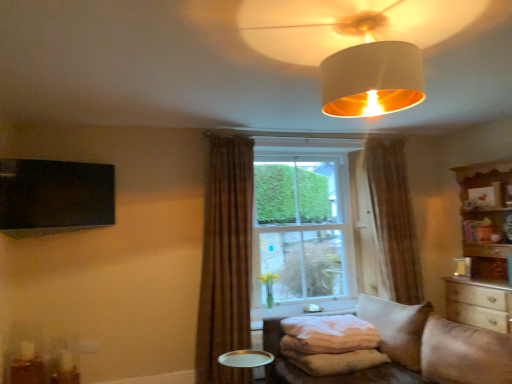
Locate an element on the screen. This screenshot has height=384, width=512. white fabric lampshade at upper center is located at coordinates (357, 44).

What do you see at coordinates (357, 44) in the screenshot?
I see `white fabric lampshade at upper center` at bounding box center [357, 44].

Locate an element on the screen. Image resolution: width=512 pixels, height=384 pixels. beige fabric studio couch at lower right is located at coordinates (420, 349).

Find the location of a particular element. Image resolution: width=512 pixels, height=384 pixels. white soft pillow at lower center is located at coordinates [x=328, y=334].

Image resolution: width=512 pixels, height=384 pixels. What do you see at coordinates (226, 260) in the screenshot?
I see `brown textured curtain at center, which is counted as the 2th curtain, starting from the back` at bounding box center [226, 260].

The image size is (512, 384). I want to click on white fabric lampshade at upper center, so click(357, 44).

From a real-world perspective, is brown sheer curtain at center, which is counted as the second curtain, starting from the front, physically located above or below metallic silver tray at lower center?

From a real-world perspective, brown sheer curtain at center, which is counted as the second curtain, starting from the front, is physically above metallic silver tray at lower center.

Identify the location of round table that appears in front of the brown sheer curtain at center, the first curtain in the right-to-left sequence. (246, 359).

Is brown sheer curtain at center, the first curtain in the right-to-left sequence, not inside metallic silver tray at lower center?

Absolutely, brown sheer curtain at center, the first curtain in the right-to-left sequence, is external to metallic silver tray at lower center.

Does beige fabric studio couch at lower right have a lesser height compared to clear glass window at center?

Indeed, beige fabric studio couch at lower right has a lesser height compared to clear glass window at center.

How many degrees apart are the facing directions of beige fabric studio couch at lower right and clear glass window at center?

91.1 degrees.

Is clear glass window at center inside beige fabric studio couch at lower right?

That's incorrect, clear glass window at center is not inside beige fabric studio couch at lower right.

Is point (282, 361) more distant than point (329, 292)?

No, it is not.

Consider the image. Which of these two, white soft pillow at lower center or white fabric lampshade at upper center, is bigger?

With larger size is white fabric lampshade at upper center.

Is white fabric lampshade at upper center a part of white soft pillow at lower center?

No, white fabric lampshade at upper center is not surrounded by white soft pillow at lower center.

At what (x,y) coordinates should I click in order to perform the action: click on pillow on the right of white fabric lampshade at upper center. Please return your answer as a coordinate pair (x, y). The image size is (512, 384). Looking at the image, I should click on (328, 334).

Is beige fabric studio couch at lower right facing towards white soft pillow at lower center?

No, beige fabric studio couch at lower right is not facing towards white soft pillow at lower center.

Which is behind, point (431, 346) or point (329, 351)?

Positioned behind is point (329, 351).

Looking at this image, which object is closer to the camera taking this photo, beige fabric studio couch at lower right or white soft pillow at lower center?

Positioned in front is beige fabric studio couch at lower right.

From a real-world perspective, who is located lower, beige fabric studio couch at lower right or white soft pillow at lower center?

beige fabric studio couch at lower right, from a real-world perspective.

From the picture: Considering the relative sizes of white fabric lampshade at upper center and metallic silver tray at lower center in the image provided, is white fabric lampshade at upper center wider than metallic silver tray at lower center?

Yes.

Based on the photo, how many degrees apart are the facing directions of white fabric lampshade at upper center and metallic silver tray at lower center?

The facing directions of white fabric lampshade at upper center and metallic silver tray at lower center are 10.2 degrees apart.

From a real-world perspective, is white fabric lampshade at upper center on metallic silver tray at lower center?

Indeed, from a real-world perspective, white fabric lampshade at upper center stands above metallic silver tray at lower center.

Can you see white fabric lampshade at upper center touching metallic silver tray at lower center?

There is a gap between white fabric lampshade at upper center and metallic silver tray at lower center.

Considering the points (334, 222) and (478, 370), which point is in front, point (334, 222) or point (478, 370)?

The point (478, 370) is in front.

From the image's perspective, which is below, clear glass window at center or beige fabric studio couch at lower right?

beige fabric studio couch at lower right appears lower in the image.

Does clear glass window at center have a larger size compared to beige fabric studio couch at lower right?

No.

From a real-world perspective, is clear glass window at center physically located above or below beige fabric studio couch at lower right?

In terms of real-world spatial position, clear glass window at center is above beige fabric studio couch at lower right.

Is metallic silver tray at lower center looking in the opposite direction of beige fabric studio couch at lower right?

Yes.

Considering the relative sizes of metallic silver tray at lower center and beige fabric studio couch at lower right in the image provided, is metallic silver tray at lower center shorter than beige fabric studio couch at lower right?

Yes.

You are a GUI agent. You are given a task and a screenshot of the screen. Output one action in this format:
    pyautogui.click(x=<x>, y=<y>)
    Task: Click on the studio couch located in front of the metallic silver tray at lower center
    Image resolution: width=512 pixels, height=384 pixels.
    Given the screenshot: What is the action you would take?
    pyautogui.click(x=420, y=349)

The height and width of the screenshot is (384, 512). Identify the location of curtain that is on the right side of metallic silver tray at lower center. (393, 219).

Locate an element on the screen. Image resolution: width=512 pixels, height=384 pixels. window located above the beige fabric studio couch at lower right (from the image's perspective) is located at coordinates (313, 229).

Estimate the real-world distances between objects in this image. Which object is further from beige fabric studio couch at lower right, brown sheer curtain at center, placed as the 1th curtain when sorted from back to front, or brown textured curtain at center, placed as the first curtain when sorted from front to back?

Among the two, brown sheer curtain at center, placed as the 1th curtain when sorted from back to front, is located further to beige fabric studio couch at lower right.

Which object lies further to the anchor point beige fabric studio couch at lower right, brown textured curtain at center, which is counted as the 2th curtain, starting from the back, or brown sheer curtain at center, which is counted as the second curtain, starting from the front?

brown sheer curtain at center, which is counted as the second curtain, starting from the front, lies further to beige fabric studio couch at lower right than the other object.

Looking at the image, which one is located further to white fabric lampshade at upper center, wooden cabinet at right or metallic silver tray at lower center?

wooden cabinet at right is positioned further to the anchor white fabric lampshade at upper center.

Based on their spatial positions, is white soft pillow at lower center or beige fabric studio couch at lower right closer to white fabric lampshade at upper center?

Based on the image, beige fabric studio couch at lower right appears to be nearer to white fabric lampshade at upper center.

Estimate the real-world distances between objects in this image. Which object is closer to clear glass window at center, beige fabric studio couch at lower right or metallic silver tray at lower center?

beige fabric studio couch at lower right lies closer to clear glass window at center than the other object.

Looking at the image, which one is located further to clear glass window at center, metallic silver tray at lower center or white fabric lampshade at upper center?

The object further to clear glass window at center is white fabric lampshade at upper center.

Looking at the image, which one is located closer to brown textured curtain at center, acting as the first curtain starting from the left, white soft pillow at lower center or beige fabric studio couch at lower right?

Among the two, white soft pillow at lower center is located nearer to brown textured curtain at center, acting as the first curtain starting from the left.

Based on their spatial positions, is white fabric lampshade at upper center or brown sheer curtain at center, the first curtain in the right-to-left sequence, closer to metallic silver tray at lower center?

Based on the image, brown sheer curtain at center, the first curtain in the right-to-left sequence, appears to be nearer to metallic silver tray at lower center.

The image size is (512, 384). I want to click on pillow between white fabric lampshade at upper center and metallic silver tray at lower center in the vertical direction, so click(328, 334).

Where is `lamp located between metallic silver tray at lower center and wooden cabinet at right in the left-right direction`? Image resolution: width=512 pixels, height=384 pixels. lamp located between metallic silver tray at lower center and wooden cabinet at right in the left-right direction is located at coordinates (357, 44).

Image resolution: width=512 pixels, height=384 pixels. I want to click on pillow situated between white fabric lampshade at upper center and wooden cabinet at right from left to right, so click(x=328, y=334).

In order to click on pillow situated between metallic silver tray at lower center and wooden cabinet at right from left to right in this screenshot , I will do `click(328, 334)`.